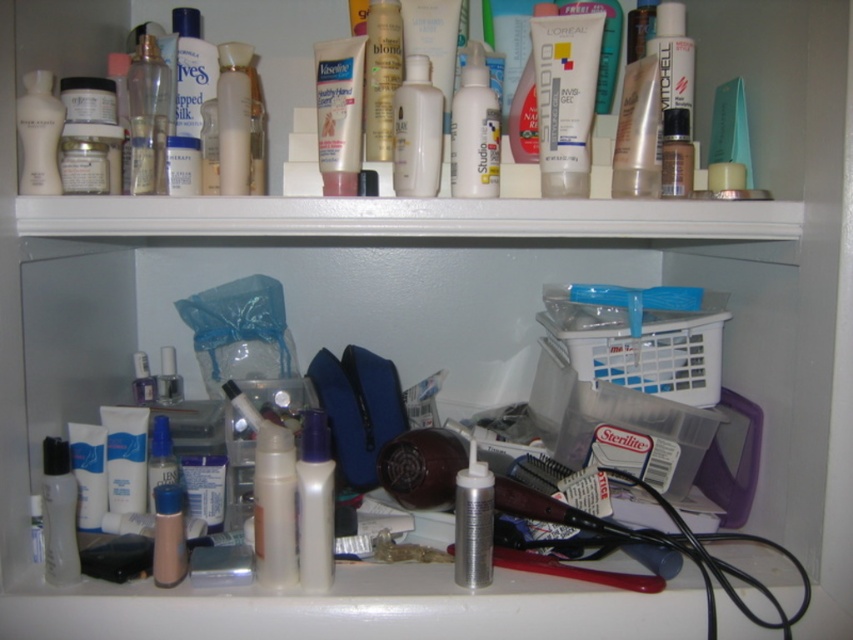
You are organizing the bathroom shelf and need to place the silver metallic spray can at center and the white matte toothpaste at lower left into a drawer that can only accommodate items narrower than 10 cm. Based on their widths, can both items fit into the drawer?

The silver metallic spray can at center has a lesser width compared to white matte toothpaste at lower left. Since the toothpaste is wider, if it is under 10 cm, both could fit. However, if the toothpaste exceeds 10 cm, neither would. Without exact measurements, we can only compare their widths but cannot confirm if they meet the drawer requirement.

You are organizing the bathroom shelf and need to place a new item between the translucent plastic lotion at center and the matte white lotion at upper center. Which direction should you move the new item to align it with the existing arrangement?

To align with the existing arrangement, the new item should be placed to the right of the matte white lotion at upper center since the translucent plastic lotion at center is already positioned to its right.